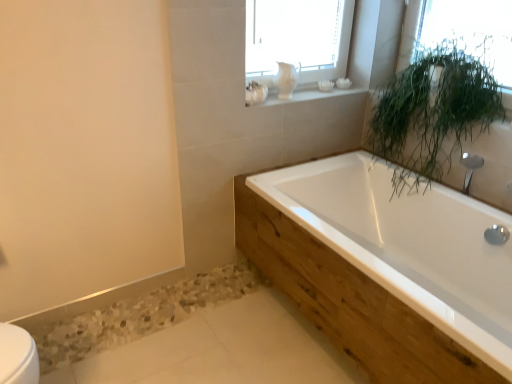
Question: Considering the positions of point (268, 104) and point (475, 16), is point (268, 104) closer or farther from the camera than point (475, 16)?

Choices:
 (A) farther
 (B) closer

Answer: (A)

Question: Considering the positions of white ceramic objects at upper center and green leafy plant at upper right in the image, is white ceramic objects at upper center taller or shorter than green leafy plant at upper right?

Choices:
 (A) short
 (B) tall

Answer: (A)

Question: Which of these objects is positioned closest to the green leafy plant at upper right?

Choices:
 (A) white ceramic objects at upper center
 (B) white glossy bathtub at center
 (C) green leafy plant at upper right

Answer: (C)

Question: Which object is positioned farthest from the green leafy plant at upper right?

Choices:
 (A) white glossy bathtub at center
 (B) white ceramic objects at upper center
 (C) green leafy plant at upper right

Answer: (B)